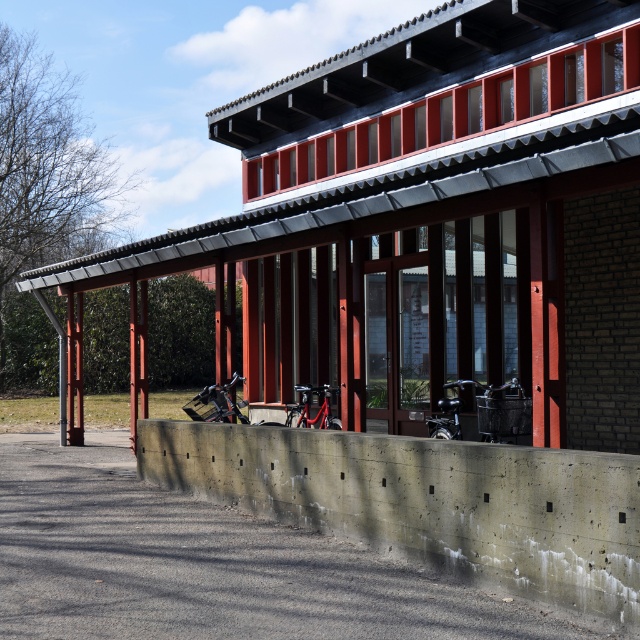
Question: Does metallic silver motorcycle at center appear under shiny metallic motorcycle at center?

Choices:
 (A) yes
 (B) no

Answer: (A)

Question: Does metallic silver motorcycle at center lie behind shiny black motorcycle at center?

Choices:
 (A) no
 (B) yes

Answer: (B)

Question: Which point is farther from the camera taking this photo?

Choices:
 (A) (305, 419)
 (B) (212, 387)
 (C) (259, 220)

Answer: (B)

Question: Which point appears farthest from the camera in this image?

Choices:
 (A) (449, 436)
 (B) (289, 404)
 (C) (611, 260)

Answer: (B)

Question: Which object is the farthest from the shiny black motorcycle at center?

Choices:
 (A) concrete at lower center
 (B) metallic silver motorcycle at center
 (C) shiny metallic motorcycle at center

Answer: (B)

Question: From the image, what is the correct spatial relationship of metallic silver motorcycle at center in relation to shiny black motorcycle at center?

Choices:
 (A) left
 (B) right

Answer: (A)